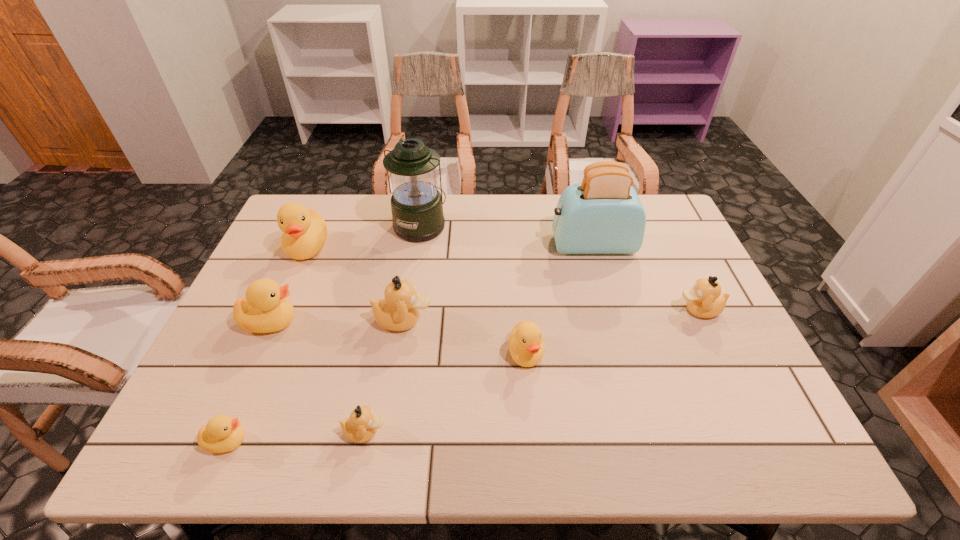
I want to click on the rightmost yellow duckling, so click(x=526, y=345).

Identify the location of the smallest tan duckling. (361, 426).

Find the location of `the nearest yellow duckling`. the nearest yellow duckling is located at coordinates (222, 433).

Image resolution: width=960 pixels, height=540 pixels. Identify the location of vacant space located 0.090m on the left of the lantern. (366, 226).

You are a GUI agent. You are given a task and a screenshot of the screen. Output one action in this format:
    pyautogui.click(x=<x>, y=<y>)
    Task: Click on the free space located 0.360m on the side of the toaster with the lever
    The image size is (960, 540).
    Given the screenshot: What is the action you would take?
    pyautogui.click(x=433, y=245)

In order to click on free space located on the side of the toaster with the lever in this screenshot , I will do `click(475, 245)`.

Locate an element on the screen. vacant space located on the side of the toaster with the lever is located at coordinates (530, 245).

You are a GUI agent. You are given a task and a screenshot of the screen. Output one action in this format:
    pyautogui.click(x=<x>, y=<y>)
    Task: Click on the free space located on the face of the farthest yellow duckling
    
    Given the screenshot: What is the action you would take?
    pyautogui.click(x=275, y=322)

I want to click on vacant area located 0.120m on the face of the biggest tan duckling, so click(x=479, y=320).

This screenshot has width=960, height=540. What are the coordinates of `blank space located on the face of the second biggest yellow duckling` in the screenshot? It's located at (420, 322).